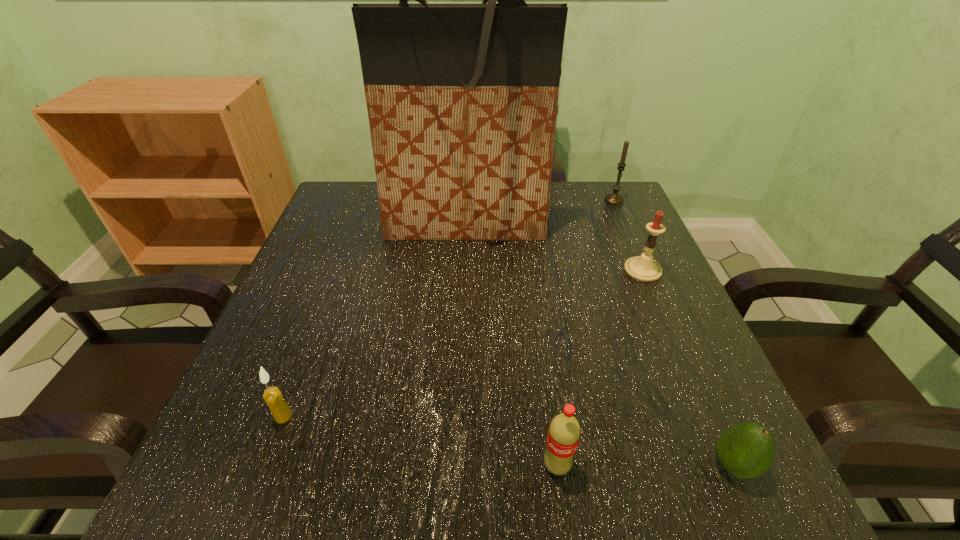
You are a GUI agent. You are given a task and a screenshot of the screen. Output one action in this format:
    pyautogui.click(x=<x>, y=<y>)
    Task: Click on the vacant space located on the right of the soda
    
    Given the screenshot: What is the action you would take?
    pyautogui.click(x=620, y=465)

Where is `vacant region located on the back of the leftmost object`? vacant region located on the back of the leftmost object is located at coordinates (300, 373).

Locate an element on the screen. The image size is (960, 540). free region located on the back of the avocado is located at coordinates coord(675,334).

The image size is (960, 540). Find the location of `shopping bag that is at the far edge`. shopping bag that is at the far edge is located at coordinates (462, 98).

You are a GUI agent. You are given a task and a screenshot of the screen. Output one action in this format:
    pyautogui.click(x=<x>, y=<y>)
    Task: Click on the candle that is positioned at the far edge
    The image size is (960, 540).
    Given the screenshot: What is the action you would take?
    pyautogui.click(x=614, y=198)

Find the location of a particular element. soda that is at the near edge is located at coordinates (564, 431).

Locate an element on the screen. The image size is (960, 540). avocado that is at the near edge is located at coordinates (746, 450).

Where is `object that is positioned at the left edge`? object that is positioned at the left edge is located at coordinates (273, 397).

Identify the location of avocado present at the right edge. (746, 450).

Where is `object present at the far right corner`? This screenshot has height=540, width=960. object present at the far right corner is located at coordinates (614, 198).